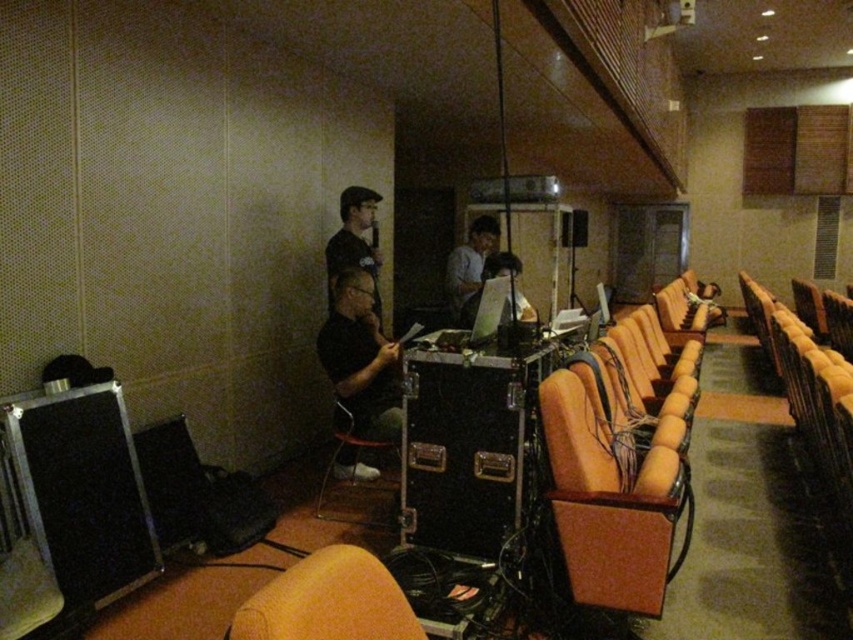
You are a photographer positioned at the back of the room. You want to take a photo that includes both the matte black shirt at center and the dark blue shirt at center. Which shirt will appear larger in the photo?

The matte black shirt at center will appear larger in the photo because it is closer to the viewer than the dark blue shirt at center.

You are an event coordinator checking the setup. You need to ensure that the dark blue shirt at center and the metallic silver speaker at center are visible to the audience seated in the front row. Which object might block the view of the other?

The dark blue shirt at center is taller than the metallic silver speaker at center, so it might block the view of the metallic silver speaker at center from the front row.

You are setting up for a presentation and need to place a decorative plant between the metallic black speaker at lower left and the matte black shirt at center. Which object should the plant be closer to if you want it to be closer to the shorter object?

The metallic black speaker at lower left is not as tall as the matte black shirt at center, so the plant should be placed closer to the metallic black speaker at lower left since it is the shorter object.